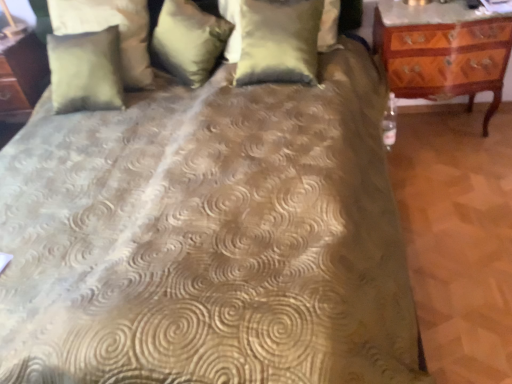
In order to click on suede-like beige pillow at upper left, the third pillow when ordered from right to left in this screenshot , I will do `click(108, 26)`.

The width and height of the screenshot is (512, 384). What do you see at coordinates (189, 40) in the screenshot? I see `satin gold pillow at upper center, which is counted as the 2th pillow, starting from the right` at bounding box center [189, 40].

Locate an element on the screen. The height and width of the screenshot is (384, 512). satin gold pillow at center, placed as the first pillow when sorted from right to left is located at coordinates (279, 41).

Locate an element on the screen. wooden carved nightstand at right is located at coordinates (443, 56).

What do you see at coordinates (443, 56) in the screenshot? This screenshot has width=512, height=384. I see `wooden carved nightstand at right` at bounding box center [443, 56].

The height and width of the screenshot is (384, 512). Find the location of `suede-like beige pillow at upper left, arranged as the first pillow when viewed from the left`. suede-like beige pillow at upper left, arranged as the first pillow when viewed from the left is located at coordinates (108, 26).

Which object is closer to the camera, satin gold pillow at center, the third pillow from the left, or satin gold pillow at upper center, which is counted as the 2th pillow, starting from the right?

satin gold pillow at center, the third pillow from the left, is closer to the camera.

Is satin gold pillow at center, the third pillow from the left, taller than satin gold pillow at upper center, the second pillow positioned from the left?

Correct, satin gold pillow at center, the third pillow from the left, is much taller as satin gold pillow at upper center, the second pillow positioned from the left.

From the image's perspective, which one is positioned lower, satin gold pillow at center, placed as the first pillow when sorted from right to left, or satin gold pillow at upper center, the second pillow positioned from the left?

From the image's view, satin gold pillow at center, placed as the first pillow when sorted from right to left, is below.

Is point (285, 22) closer or farther from the camera than point (177, 59)?

Point (285, 22) is closer to the camera than point (177, 59).

From the image's perspective, which one is positioned higher, suede-like beige pillow at upper left, arranged as the first pillow when viewed from the left, or satin gold pillow at upper center, the second pillow positioned from the left?

satin gold pillow at upper center, the second pillow positioned from the left, from the image's perspective.

Does suede-like beige pillow at upper left, the third pillow when ordered from right to left, have a lesser width compared to satin gold pillow at upper center, the second pillow positioned from the left?

Yes, suede-like beige pillow at upper left, the third pillow when ordered from right to left, is thinner than satin gold pillow at upper center, the second pillow positioned from the left.

Who is taller, suede-like beige pillow at upper left, arranged as the first pillow when viewed from the left, or satin gold pillow at upper center, the second pillow positioned from the left?

suede-like beige pillow at upper left, arranged as the first pillow when viewed from the left.

Is suede-like beige pillow at upper left, arranged as the first pillow when viewed from the left, a part of satin gold pillow at center, the third pillow from the left?

No, suede-like beige pillow at upper left, arranged as the first pillow when viewed from the left, is not inside satin gold pillow at center, the third pillow from the left.

Considering the points (253, 62) and (130, 4), which point is behind, point (253, 62) or point (130, 4)?

The point (130, 4) is farther.

Considering the positions of objects satin gold pillow at center, placed as the first pillow when sorted from right to left, and suede-like beige pillow at upper left, the third pillow when ordered from right to left, in the image provided, who is behind, satin gold pillow at center, placed as the first pillow when sorted from right to left, or suede-like beige pillow at upper left, the third pillow when ordered from right to left,?

suede-like beige pillow at upper left, the third pillow when ordered from right to left, is behind.

How many degrees apart are the facing directions of satin gold pillow at center, the third pillow from the left, and suede-like beige pillow at upper left, arranged as the first pillow when viewed from the left?

The angle between the facing direction of satin gold pillow at center, the third pillow from the left, and the facing direction of suede-like beige pillow at upper left, arranged as the first pillow when viewed from the left, is 0.00133 degrees.

Considering the sizes of suede-like beige pillow at upper left, the third pillow when ordered from right to left, and wooden carved nightstand at right in the image, is suede-like beige pillow at upper left, the third pillow when ordered from right to left, wider or thinner than wooden carved nightstand at right?

Considering their sizes, suede-like beige pillow at upper left, the third pillow when ordered from right to left, looks slimmer than wooden carved nightstand at right.

Is suede-like beige pillow at upper left, arranged as the first pillow when viewed from the left, looking in the opposite direction of wooden carved nightstand at right?

suede-like beige pillow at upper left, arranged as the first pillow when viewed from the left, is not turned away from wooden carved nightstand at right.

Which is more to the right, suede-like beige pillow at upper left, the third pillow when ordered from right to left, or wooden carved nightstand at right?

wooden carved nightstand at right is more to the right.

Locate an element on the screen. nightstand below the suede-like beige pillow at upper left, arranged as the first pillow when viewed from the left (from a real-world perspective) is located at coordinates (443, 56).

Who is shorter, wooden carved nightstand at right or suede-like beige pillow at upper left, the third pillow when ordered from right to left?

suede-like beige pillow at upper left, the third pillow when ordered from right to left, is shorter.

Is wooden carved nightstand at right touching suede-like beige pillow at upper left, the third pillow when ordered from right to left?

They are not placed beside each other.

From the picture: Based on their sizes in the image, would you say wooden carved nightstand at right is bigger or smaller than suede-like beige pillow at upper left, arranged as the first pillow when viewed from the left?

In the image, wooden carved nightstand at right appears to be larger than suede-like beige pillow at upper left, arranged as the first pillow when viewed from the left.

Would you say wooden carved nightstand at right is to the left or to the right of satin gold pillow at upper center, which is counted as the 2th pillow, starting from the right, in the picture?

wooden carved nightstand at right is positioned on satin gold pillow at upper center, which is counted as the 2th pillow, starting from the right,'s right side.

Can you confirm if wooden carved nightstand at right is wider than satin gold pillow at upper center, the second pillow positioned from the left?

Correct, the width of wooden carved nightstand at right exceeds that of satin gold pillow at upper center, the second pillow positioned from the left.

From the image's perspective, count 3rd pillows upward from the wooden carved nightstand at right and point to it. Please provide its 2D coordinates.

[(189, 40)]

From a real-world perspective, is wooden carved nightstand at right positioned above or below satin gold pillow at center, the third pillow from the left?

From a real-world perspective, wooden carved nightstand at right is physically below satin gold pillow at center, the third pillow from the left.

Is wooden carved nightstand at right not near satin gold pillow at center, the third pillow from the left?

Actually, wooden carved nightstand at right and satin gold pillow at center, the third pillow from the left, are a little close together.

From the image's perspective, is wooden carved nightstand at right located beneath satin gold pillow at center, the third pillow from the left?

Yes.

I want to click on pillow to the right of satin gold pillow at upper center, the second pillow positioned from the left, so click(x=279, y=41).

The height and width of the screenshot is (384, 512). I want to click on the 2nd pillow below the satin gold pillow at upper center, which is counted as the 2th pillow, starting from the right (from the image's perspective), so click(x=108, y=26).

Looking at the image, which one is located closer to wooden carved nightstand at right, satin gold pillow at upper center, which is counted as the 2th pillow, starting from the right, or satin gold pillow at center, placed as the first pillow when sorted from right to left?

Based on the image, satin gold pillow at center, placed as the first pillow when sorted from right to left, appears to be nearer to wooden carved nightstand at right.

Looking at the image, which one is located further to satin gold pillow at upper center, the second pillow positioned from the left, wooden carved nightstand at right or satin gold pillow at center, placed as the first pillow when sorted from right to left?

wooden carved nightstand at right is positioned further to the anchor satin gold pillow at upper center, the second pillow positioned from the left.

From the picture: When comparing their distances from wooden carved nightstand at right, does satin gold pillow at upper center, which is counted as the 2th pillow, starting from the right, or suede-like beige pillow at upper left, arranged as the first pillow when viewed from the left, seem further?

suede-like beige pillow at upper left, arranged as the first pillow when viewed from the left, is further to wooden carved nightstand at right.

Considering their positions, is satin gold pillow at center, placed as the first pillow when sorted from right to left, positioned further to suede-like beige pillow at upper left, the third pillow when ordered from right to left, than wooden carved nightstand at right?

wooden carved nightstand at right is further to suede-like beige pillow at upper left, the third pillow when ordered from right to left.

Estimate the real-world distances between objects in this image. Which object is closer to suede-like beige pillow at upper left, the third pillow when ordered from right to left, satin gold pillow at upper center, which is counted as the 2th pillow, starting from the right, or wooden carved nightstand at right?

Based on the image, satin gold pillow at upper center, which is counted as the 2th pillow, starting from the right, appears to be nearer to suede-like beige pillow at upper left, the third pillow when ordered from right to left.

When comparing their distances from suede-like beige pillow at upper left, arranged as the first pillow when viewed from the left, does wooden carved nightstand at right or satin gold pillow at center, placed as the first pillow when sorted from right to left, seem closer?

Among the two, satin gold pillow at center, placed as the first pillow when sorted from right to left, is located nearer to suede-like beige pillow at upper left, arranged as the first pillow when viewed from the left.

From the image, which object appears to be farther from satin gold pillow at upper center, which is counted as the 2th pillow, starting from the right, satin gold pillow at center, the third pillow from the left, or wooden carved nightstand at right?

Among the two, wooden carved nightstand at right is located further to satin gold pillow at upper center, which is counted as the 2th pillow, starting from the right.

Estimate the real-world distances between objects in this image. Which object is closer to satin gold pillow at upper center, which is counted as the 2th pillow, starting from the right, suede-like beige pillow at upper left, arranged as the first pillow when viewed from the left, or satin gold pillow at center, placed as the first pillow when sorted from right to left?

suede-like beige pillow at upper left, arranged as the first pillow when viewed from the left.

Locate an element on the screen. The height and width of the screenshot is (384, 512). pillow located between suede-like beige pillow at upper left, arranged as the first pillow when viewed from the left, and satin gold pillow at center, placed as the first pillow when sorted from right to left, in the left-right direction is located at coordinates (189, 40).

This screenshot has width=512, height=384. Find the location of `pillow situated between satin gold pillow at upper center, which is counted as the 2th pillow, starting from the right, and wooden carved nightstand at right from left to right`. pillow situated between satin gold pillow at upper center, which is counted as the 2th pillow, starting from the right, and wooden carved nightstand at right from left to right is located at coordinates (279, 41).